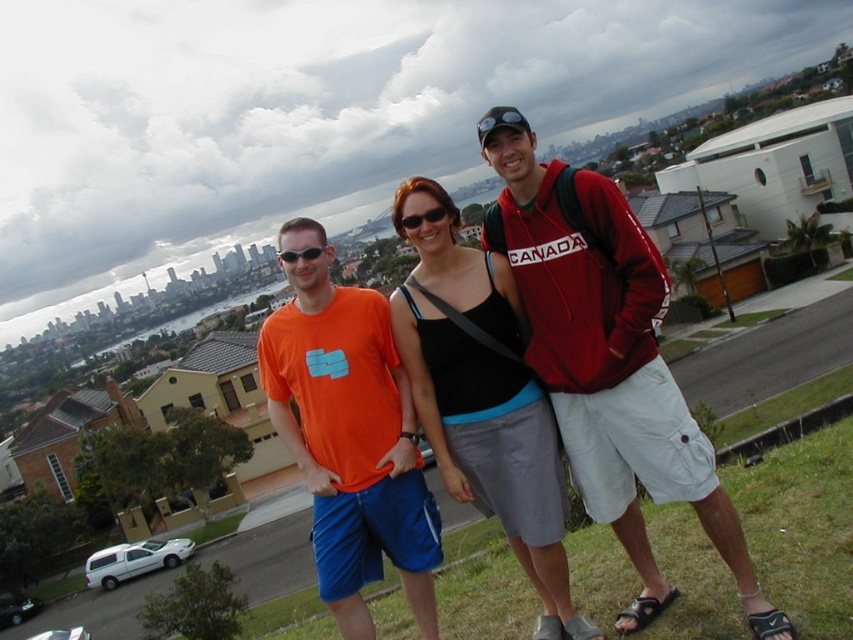
Is point (579, 467) farther from viewer compared to point (523, 504)?

Yes, point (579, 467) is behind point (523, 504).

Find the location of a particular element. The width and height of the screenshot is (853, 640). red cotton hoodie at center is located at coordinates (608, 360).

The image size is (853, 640). I want to click on red cotton hoodie at center, so click(608, 360).

Who is more distant from viewer, (x=370, y=499) or (x=471, y=474)?

Point (x=471, y=474)

Which is more to the right, orange t-shirt at center or black matte tank top at center?

Positioned to the right is black matte tank top at center.

Which is behind, point (289, 220) or point (438, 380)?

Point (289, 220)

I want to click on orange t-shirt at center, so click(349, 436).

Between red cotton hoodie at center and orange t-shirt at center, which one appears on the left side from the viewer's perspective?

orange t-shirt at center is more to the left.

Which is more to the right, red cotton hoodie at center or orange t-shirt at center?

red cotton hoodie at center

Does point (686, 422) lie in front of point (341, 488)?

Yes, it is.

This screenshot has width=853, height=640. Identify the location of red cotton hoodie at center. (608, 360).